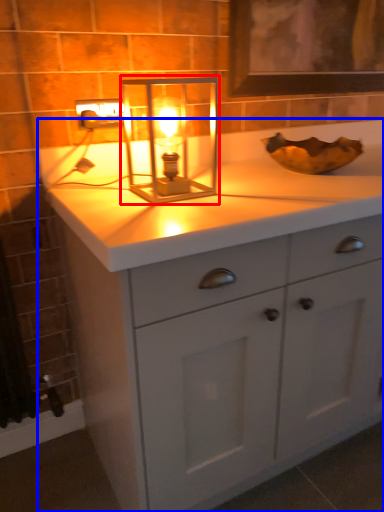
Question: Which object appears farthest to the camera in this image, candle holder (highlighted by a red box) or bathroom cabinet (highlighted by a blue box)?

Choices:
 (A) candle holder
 (B) bathroom cabinet

Answer: (A)